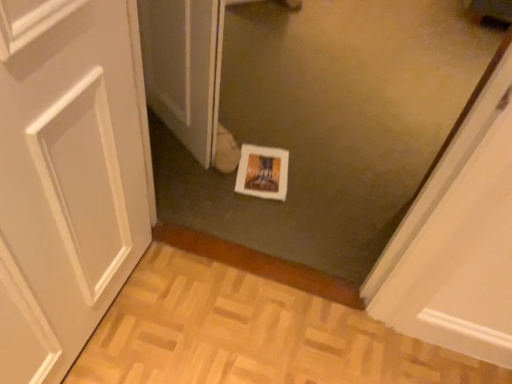
What are the coordinates of `free space to the back side of white glossy print at center` in the screenshot? It's located at tap(269, 131).